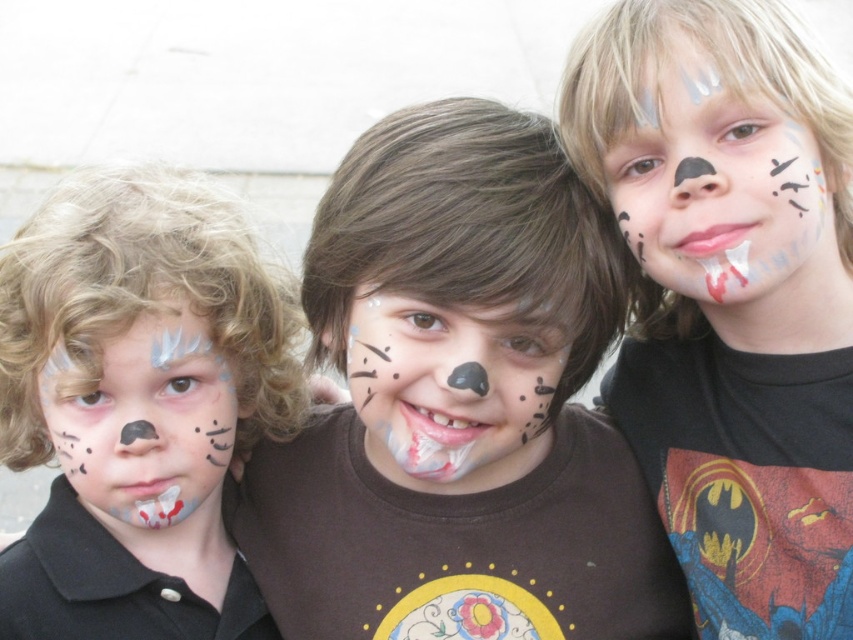
Who is positioned more to the left, matte brown shirt at center or matte black face paint at center?

matte brown shirt at center

Measure the distance between matte brown shirt at center and matte black face paint at center.

matte brown shirt at center and matte black face paint at center are 80.24 centimeters apart.

Who is more forward, [461,310] or [657,365]?

Point [461,310] is more forward.

In order to click on matte brown shirt at center in this screenshot , I will do `click(457, 404)`.

Between white matte face paint at upper right and matte white face paint at left, which one is positioned lower?

matte white face paint at left is lower down.

Is white matte face paint at upper right behind matte white face paint at left?

That is False.

Does point (718, 168) come behind point (128, 378)?

No, (718, 168) is in front of (128, 378).

Locate an element on the screen. The width and height of the screenshot is (853, 640). white matte face paint at upper right is located at coordinates (721, 188).

Between matte black face paint at center and white matte face paint at center, which one appears on the left side from the viewer's perspective?

white matte face paint at center is more to the left.

Is point (798, 435) more distant than point (494, 330)?

Yes, point (798, 435) is behind point (494, 330).

The image size is (853, 640). What are the coordinates of `matte black face paint at center` in the screenshot? It's located at (730, 296).